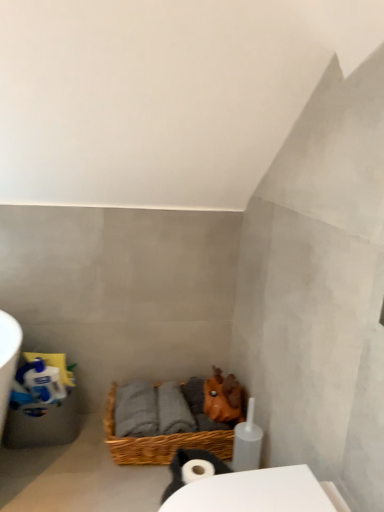
Question: Looking at the image, does white matte toilet paper roll at lower center seem bigger or smaller compared to woven brown basket at lower center?

Choices:
 (A) big
 (B) small

Answer: (B)

Question: Considering the positions of white matte toilet paper roll at lower center and woven brown basket at lower center in the image, is white matte toilet paper roll at lower center taller or shorter than woven brown basket at lower center?

Choices:
 (A) tall
 (B) short

Answer: (B)

Question: Does point (190, 452) appear closer or farther from the camera than point (150, 437)?

Choices:
 (A) farther
 (B) closer

Answer: (B)

Question: Do you think woven brown basket at lower center is within white matte toilet paper roll at lower center, or outside of it?

Choices:
 (A) outside
 (B) inside

Answer: (A)

Question: Visually, is woven brown basket at lower center positioned to the left or to the right of white matte toilet paper roll at lower center?

Choices:
 (A) left
 (B) right

Answer: (A)

Question: Considering their positions, is woven brown basket at lower center located in front of or behind white matte toilet paper roll at lower center?

Choices:
 (A) behind
 (B) front

Answer: (A)

Question: Based on their sizes in the image, would you say woven brown basket at lower center is bigger or smaller than white matte toilet paper roll at lower center?

Choices:
 (A) big
 (B) small

Answer: (A)